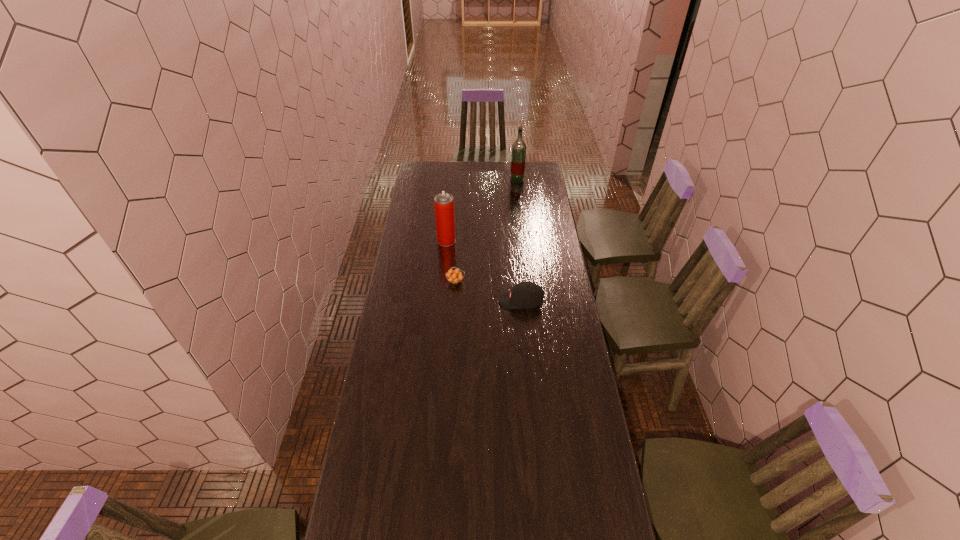
The image size is (960, 540). I want to click on liquor, so [519, 147].

At what (x,y) coordinates should I click in order to perform the action: click on the third nearest object. Please return your answer as a coordinate pair (x, y). The height and width of the screenshot is (540, 960). Looking at the image, I should click on (444, 204).

Identify the location of aerosol can. click(x=444, y=204).

You are a GUI agent. You are given a task and a screenshot of the screen. Output one action in this format:
    pyautogui.click(x=<x>, y=<y>)
    Task: Click on the second shortest object
    
    Given the screenshot: What is the action you would take?
    pyautogui.click(x=525, y=295)

Locate an element on the screen. This screenshot has height=540, width=960. baseball cap is located at coordinates (525, 295).

Image resolution: width=960 pixels, height=540 pixels. In order to click on orange fruit in this screenshot , I will do `click(455, 276)`.

Locate an element on the screen. The height and width of the screenshot is (540, 960). the third farthest object is located at coordinates (455, 276).

Where is `free location located 0.380m on the front of the farthest object`? The image size is (960, 540). free location located 0.380m on the front of the farthest object is located at coordinates (521, 221).

Locate an element on the screen. vacant position located 0.070m on the right of the second tallest object is located at coordinates (468, 241).

Where is `vacant space situated 0.310m with a logo on the front of the baseball cap`? The width and height of the screenshot is (960, 540). vacant space situated 0.310m with a logo on the front of the baseball cap is located at coordinates (432, 301).